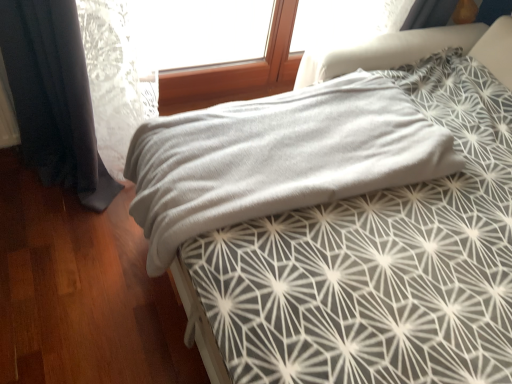
This screenshot has height=384, width=512. Describe the element at coordinates (277, 157) in the screenshot. I see `gray soft fabric at center` at that location.

At what (x,y) coordinates should I click in order to perform the action: click on gray soft fabric at center. Please return your answer as a coordinate pair (x, y). This screenshot has height=384, width=512. Looking at the image, I should click on (277, 157).

This screenshot has width=512, height=384. What do you see at coordinates (345, 218) in the screenshot? I see `gray soft fabric at center` at bounding box center [345, 218].

Where is `gray soft fabric at center`? gray soft fabric at center is located at coordinates (345, 218).

At what (x,y) coordinates should I click in order to perform the action: click on gray soft fabric at center. Please return your answer as a coordinate pair (x, y). The width and height of the screenshot is (512, 384). Looking at the image, I should click on (277, 157).

Visually, is gray soft fabric at center positioned to the left or to the right of gray soft fabric at center?

Based on their positions, gray soft fabric at center is located to the right of gray soft fabric at center.

Between gray soft fabric at center and gray soft fabric at center, which one is positioned in front?

gray soft fabric at center is in front.

Is point (340, 222) farther from viewer compared to point (168, 260)?

No, it is not.

From the image's perspective, is gray soft fabric at center positioned above or below gray soft fabric at center?

gray soft fabric at center is above gray soft fabric at center.

From a real-world perspective, is gray soft fabric at center positioned over gray soft fabric at center based on gravity?

Indeed, from a real-world perspective, gray soft fabric at center stands above gray soft fabric at center.

Can you confirm if gray soft fabric at center is thinner than gray soft fabric at center?

In fact, gray soft fabric at center might be wider than gray soft fabric at center.

Is gray soft fabric at center taller than gray soft fabric at center?

Yes, gray soft fabric at center is taller than gray soft fabric at center.

Between gray soft fabric at center and gray soft fabric at center, which one has larger size?

With larger size is gray soft fabric at center.

Would you say gray soft fabric at center is part of gray soft fabric at center's contents?

That's correct, gray soft fabric at center is inside gray soft fabric at center.

Would you consider gray soft fabric at center to be distant from gray soft fabric at center?

No, gray soft fabric at center is not far away from gray soft fabric at center.

Could you tell me if gray soft fabric at center is facing gray soft fabric at center?

Yes, gray soft fabric at center is oriented towards gray soft fabric at center.

Locate an element on the screen. This screenshot has height=384, width=512. blanket on the left side of gray soft fabric at center is located at coordinates (277, 157).

Looking at this image, considering the relative positions of gray soft fabric at center and gray soft fabric at center in the image provided, is gray soft fabric at center to the right of gray soft fabric at center from the viewer's perspective?

In fact, gray soft fabric at center is to the left of gray soft fabric at center.

Who is more distant, gray soft fabric at center or gray soft fabric at center?

gray soft fabric at center.

Considering the positions of points (186, 151) and (178, 289), is point (186, 151) farther from camera compared to point (178, 289)?

No, it is not.

From the image's perspective, is gray soft fabric at center below gray soft fabric at center?

Correct, gray soft fabric at center appears lower than gray soft fabric at center in the image.

From a real-world perspective, is gray soft fabric at center on gray soft fabric at center?

No, from a real-world perspective, gray soft fabric at center is not on top of gray soft fabric at center.

Looking at their sizes, would you say gray soft fabric at center is wider or thinner than gray soft fabric at center?

Clearly, gray soft fabric at center has less width compared to gray soft fabric at center.

Can you confirm if gray soft fabric at center is taller than gray soft fabric at center?

Incorrect, the height of gray soft fabric at center is not larger of that of gray soft fabric at center.

Between gray soft fabric at center and gray soft fabric at center, which one has larger size?

gray soft fabric at center.

Which is correct: gray soft fabric at center is inside gray soft fabric at center, or outside of it?

The correct answer is: inside.

Are gray soft fabric at center and gray soft fabric at center beside each other?

Yes, gray soft fabric at center is with gray soft fabric at center.

Is gray soft fabric at center looking in the opposite direction of gray soft fabric at center?

Yes.

How different are the orientations of gray soft fabric at center and gray soft fabric at center in degrees?

The facing directions of gray soft fabric at center and gray soft fabric at center are 0.784 degrees apart.

Find the location of a particular element. The image size is (512, 384). blanket below the gray soft fabric at center (from the image's perspective) is located at coordinates (277, 157).

Where is `blanket on the left side of gray soft fabric at center`? This screenshot has width=512, height=384. blanket on the left side of gray soft fabric at center is located at coordinates (277, 157).

Locate an element on the screen. This screenshot has width=512, height=384. bed that appears in front of the gray soft fabric at center is located at coordinates [345, 218].